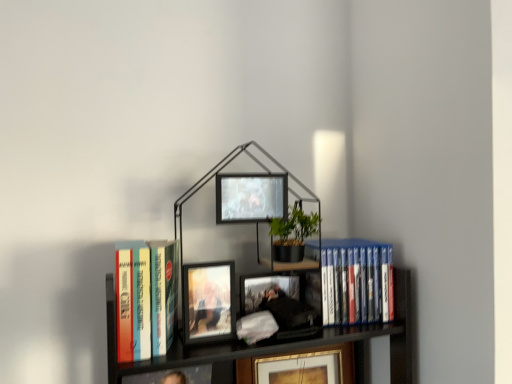
Where is `hardcover books at left, the 1th book in the front-to-back sequence`? The height and width of the screenshot is (384, 512). hardcover books at left, the 1th book in the front-to-back sequence is located at coordinates (x=146, y=297).

What do you see at coordinates (251, 197) in the screenshot? Image resolution: width=512 pixels, height=384 pixels. I see `matte black picture frame at center, which is the first picture frame in top-to-bottom order` at bounding box center [251, 197].

This screenshot has width=512, height=384. What do you see at coordinates (221, 170) in the screenshot? I see `metallic black bookcase at center` at bounding box center [221, 170].

Consider the image. What is the approximate width of metallic black bookcase at center?

It is 6.76 inches.

This screenshot has height=384, width=512. I want to click on matte wooden picture frame at center, marked as the third picture frame in a back-to-front arrangement, so click(x=209, y=302).

In order to face blue plastic dvds at right, which ranks as the 1th book in right-to-left order, should I rotate leftwards or rightwards?

Turn right approximately 13.750 degrees to face it.

Where is `hardcover books at left, the 1th book in the front-to-back sequence`? hardcover books at left, the 1th book in the front-to-back sequence is located at coordinates (146, 297).

Would you say matte black picture frame at center, arranged as the third picture frame when viewed from the top, contains matte black picture frame at center, which is the first picture frame in top-to-bottom order?

No, matte black picture frame at center, which is the first picture frame in top-to-bottom order, is not a part of matte black picture frame at center, arranged as the third picture frame when viewed from the top.

Can you confirm if matte black picture frame at center, the third picture frame in the front-to-back sequence, is thinner than matte black picture frame at center, which is the first picture frame in top-to-bottom order?

No, matte black picture frame at center, the third picture frame in the front-to-back sequence, is not thinner than matte black picture frame at center, which is the first picture frame in top-to-bottom order.

Does matte black picture frame at center, acting as the 1th picture frame starting from the back, turn towards matte black picture frame at center, marked as the 3th picture frame in a bottom-to-top arrangement?

No, matte black picture frame at center, acting as the 1th picture frame starting from the back, is not facing towards matte black picture frame at center, marked as the 3th picture frame in a bottom-to-top arrangement.

Is point (343, 354) closer or farther from the camera than point (280, 217)?

Clearly, point (343, 354) is more distant from the camera than point (280, 217).

Is blue plastic dvds at right, acting as the second book starting from the left, positioned with its back to matte wooden picture frame at center, marked as the third picture frame in a back-to-front arrangement?

blue plastic dvds at right, acting as the second book starting from the left, is not turned away from matte wooden picture frame at center, marked as the third picture frame in a back-to-front arrangement.

Can you tell me how much blue plastic dvds at right, which ranks as the 1th book in right-to-left order, and matte wooden picture frame at center, marked as the second picture frame in a bottom-to-top arrangement, differ in facing direction?

The angular difference between blue plastic dvds at right, which ranks as the 1th book in right-to-left order, and matte wooden picture frame at center, marked as the second picture frame in a bottom-to-top arrangement, is 5.55 degrees.

From the image's perspective, relative to matte wooden picture frame at center, marked as the second picture frame in a bottom-to-top arrangement, is blue plastic dvds at right, acting as the second book starting from the left, above or below?

Based on their image positions, blue plastic dvds at right, acting as the second book starting from the left, is located above matte wooden picture frame at center, marked as the second picture frame in a bottom-to-top arrangement.

Can you confirm if blue plastic dvds at right, which ranks as the 1th book in right-to-left order, is taller than matte wooden picture frame at center, marked as the third picture frame in a back-to-front arrangement?

Yes.

Is metallic black bookcase at center located within matte black picture frame at center, the first picture frame from the bottom?

Actually, metallic black bookcase at center is outside matte black picture frame at center, the first picture frame from the bottom.

Between matte black picture frame at center, acting as the 1th picture frame starting from the back, and metallic black bookcase at center, which one appears on the right side from the viewer's perspective?

From the viewer's perspective, matte black picture frame at center, acting as the 1th picture frame starting from the back, appears more on the right side.

Which is farther, (285, 362) or (252, 156)?

The point (252, 156) is behind.

Between matte black picture frame at center, which is the second picture frame from front to back, and metallic black bookcase at center, which one appears on the right side from the viewer's perspective?

Positioned to the right is matte black picture frame at center, which is the second picture frame from front to back.

Which object is further away from the camera, matte black picture frame at center, which is the first picture frame in top-to-bottom order, or metallic black bookcase at center?

matte black picture frame at center, which is the first picture frame in top-to-bottom order, is further from the camera.

Considering the points (224, 219) and (110, 303), which point is behind, point (224, 219) or point (110, 303)?

The point (224, 219) is more distant.

Does matte black picture frame at center, which ranks as the 2th picture frame in back-to-front order, have a lesser height compared to metallic black bookcase at center?

Correct, matte black picture frame at center, which ranks as the 2th picture frame in back-to-front order, is not as tall as metallic black bookcase at center.

Which picture frame is the 2nd one when counting from the right side of the hardcover books at left, arranged as the 2th book when viewed from the right? Please provide its 2D coordinates.

[(251, 197)]

Is matte black picture frame at center, which ranks as the 2th picture frame in back-to-front order, smaller than hardcover books at left, the 1th book in the front-to-back sequence?

Indeed, matte black picture frame at center, which ranks as the 2th picture frame in back-to-front order, has a smaller size compared to hardcover books at left, the 1th book in the front-to-back sequence.

Is matte black picture frame at center, which ranks as the 2th picture frame in back-to-front order, looking in the opposite direction of hardcover books at left, arranged as the 2th book when viewed from the right?

matte black picture frame at center, which ranks as the 2th picture frame in back-to-front order, does not have its back to hardcover books at left, arranged as the 2th book when viewed from the right.

In the scene shown: Would you say metallic black bookcase at center contains matte black picture frame at center, which ranks as the 2th picture frame in back-to-front order?

That's correct, matte black picture frame at center, which ranks as the 2th picture frame in back-to-front order, is inside metallic black bookcase at center.

Is metallic black bookcase at center not near matte black picture frame at center, which ranks as the 2th picture frame in back-to-front order?

They are positioned close to each other.

Which of these two, metallic black bookcase at center or matte black picture frame at center, which ranks as the 2th picture frame in back-to-front order, stands taller?

metallic black bookcase at center is taller.

Is metallic black bookcase at center aimed at matte black picture frame at center, marked as the 3th picture frame in a bottom-to-top arrangement?

Yes, metallic black bookcase at center faces towards matte black picture frame at center, marked as the 3th picture frame in a bottom-to-top arrangement.

Is blue plastic dvds at right, which ranks as the 1th book in right-to-left order, positioned before metallic black bookcase at center?

No, blue plastic dvds at right, which ranks as the 1th book in right-to-left order, is behind metallic black bookcase at center.

How different are the orientations of blue plastic dvds at right, which ranks as the second book in front-to-back order, and metallic black bookcase at center in degrees?

There is a 5.55-degree angle between the facing directions of blue plastic dvds at right, which ranks as the second book in front-to-back order, and metallic black bookcase at center.

Which of these two, blue plastic dvds at right, which ranks as the second book in front-to-back order, or metallic black bookcase at center, stands shorter?

blue plastic dvds at right, which ranks as the second book in front-to-back order.

Who is smaller, blue plastic dvds at right, acting as the second book starting from the left, or metallic black bookcase at center?

With smaller size is blue plastic dvds at right, acting as the second book starting from the left.

Locate an element on the screen. This screenshot has width=512, height=384. the 1st picture frame in front of the matte black picture frame at center, the first picture frame from the bottom, counting from the anchor's position is located at coordinates (251, 197).

There is a matte wooden picture frame at center, which appears as the first picture frame when viewed from the front. Identify the location of the 1st book above it (from the image's perspective). (354, 280).

Considering their positions, is matte black picture frame at center, marked as the 3th picture frame in a bottom-to-top arrangement, positioned further to matte wooden picture frame at center, the second picture frame viewed from the top, than matte black picture frame at center, arranged as the third picture frame when viewed from the top?

Based on the image, matte black picture frame at center, arranged as the third picture frame when viewed from the top, appears to be further to matte wooden picture frame at center, the second picture frame viewed from the top.

Looking at the image, which one is located further to matte wooden picture frame at center, marked as the third picture frame in a back-to-front arrangement, hardcover books at left, arranged as the 2th book when viewed from the right, or matte black picture frame at center, the first picture frame from the bottom?

matte black picture frame at center, the first picture frame from the bottom.

Considering their positions, is blue plastic dvds at right, which ranks as the 1th book in right-to-left order, positioned further to matte black picture frame at center, which is the second picture frame from front to back, than hardcover books at left, arranged as the 2th book when viewed from the right?

The object further to matte black picture frame at center, which is the second picture frame from front to back, is hardcover books at left, arranged as the 2th book when viewed from the right.

From the picture: When comparing their distances from metallic black bookcase at center, does matte black picture frame at center, the third picture frame in the front-to-back sequence, or matte black picture frame at center, marked as the 3th picture frame in a bottom-to-top arrangement, seem closer?

matte black picture frame at center, marked as the 3th picture frame in a bottom-to-top arrangement, is closer to metallic black bookcase at center.

Which object lies nearer to the anchor point matte wooden picture frame at center, marked as the second picture frame in a bottom-to-top arrangement, blue plastic dvds at right, which ranks as the second book in front-to-back order, or metallic black bookcase at center?

Based on the image, metallic black bookcase at center appears to be nearer to matte wooden picture frame at center, marked as the second picture frame in a bottom-to-top arrangement.

Which object lies further to the anchor point blue plastic dvds at right, which ranks as the 1th book in right-to-left order, matte black picture frame at center, which is the second picture frame from front to back, or metallic black bookcase at center?

Based on the image, matte black picture frame at center, which is the second picture frame from front to back, appears to be further to blue plastic dvds at right, which ranks as the 1th book in right-to-left order.

Based on their spatial positions, is matte black picture frame at center, arranged as the third picture frame when viewed from the top, or matte wooden picture frame at center, the second picture frame viewed from the top, further from hardcover books at left, the 1th book in the front-to-back sequence?

The object further to hardcover books at left, the 1th book in the front-to-back sequence, is matte black picture frame at center, arranged as the third picture frame when viewed from the top.

Considering their positions, is matte black picture frame at center, acting as the 1th picture frame starting from the back, positioned further to matte black picture frame at center, marked as the 3th picture frame in a bottom-to-top arrangement, than matte wooden picture frame at center, which appears as the first picture frame when viewed from the front?

matte black picture frame at center, acting as the 1th picture frame starting from the back, lies further to matte black picture frame at center, marked as the 3th picture frame in a bottom-to-top arrangement, than the other object.

The height and width of the screenshot is (384, 512). What are the coordinates of `bookcase situated between hardcover books at left, the 2th book when ordered from back to front, and blue plastic dvds at right, acting as the second book starting from the left, from left to right` in the screenshot? It's located at (221, 170).

This screenshot has width=512, height=384. I want to click on bookcase between hardcover books at left, the 2th book when ordered from back to front, and matte black picture frame at center, marked as the 3th picture frame in a bottom-to-top arrangement, in the horizontal direction, so click(x=221, y=170).

Find the location of `bookcase situated between matte wooden picture frame at center, the second picture frame viewed from the top, and blue plastic dvds at right, acting as the second book starting from the left, from left to right`. bookcase situated between matte wooden picture frame at center, the second picture frame viewed from the top, and blue plastic dvds at right, acting as the second book starting from the left, from left to right is located at coordinates (221, 170).

Identify the location of bookcase that lies between matte black picture frame at center, marked as the 3th picture frame in a bottom-to-top arrangement, and matte wooden picture frame at center, marked as the second picture frame in a bottom-to-top arrangement, from top to bottom. Image resolution: width=512 pixels, height=384 pixels. (221, 170).